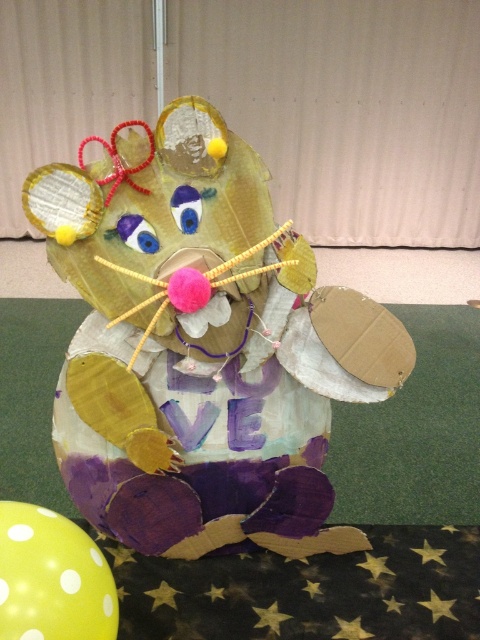
You are standing 5 feet away from the cardboard mouse sculpture. There is a point at coordinates point (x=220, y=385). Can you reach that point with your hand without moving closer to the sculpture?

The distance of point (x=220, y=385) from camera is 5.41 feet, so you are currently 5 feet away. Since the point is 0.41 feet further away, you cannot reach it without moving closer.

You are planning to place a decorative item on a shelf that can only accommodate items wider than the yellow dotted balloon at lower left. Based on the scene, can the cardboard mouse at center fit on the shelf?

The cardboard mouse at center has a width larger than the yellow dotted balloon at lower left, so it can fit on the shelf since it meets the minimum width requirement.

You are at a birthday party and see the cardboard mouse at center and the yellow dotted balloon at lower left. Which object is taller?

The cardboard mouse at center is taller than the yellow dotted balloon at lower left.